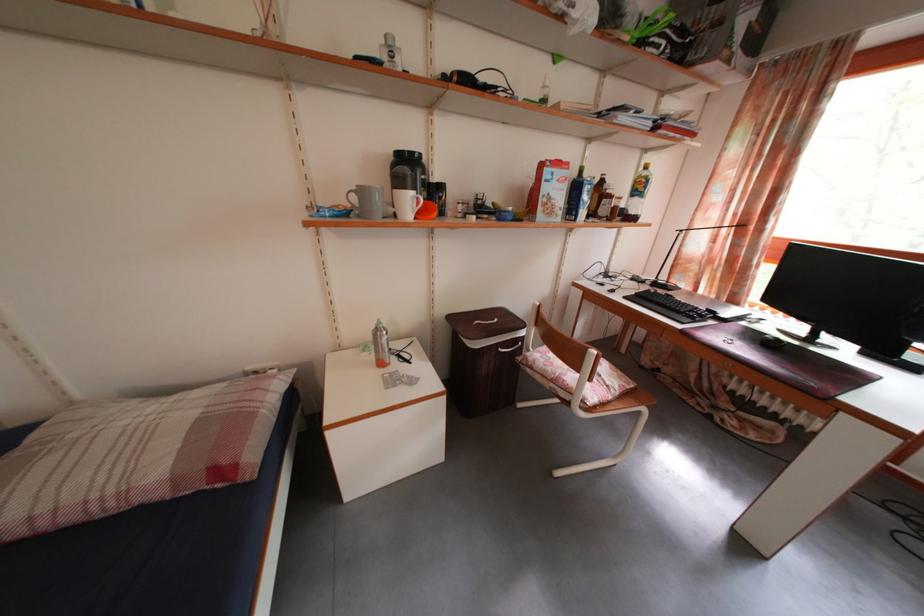
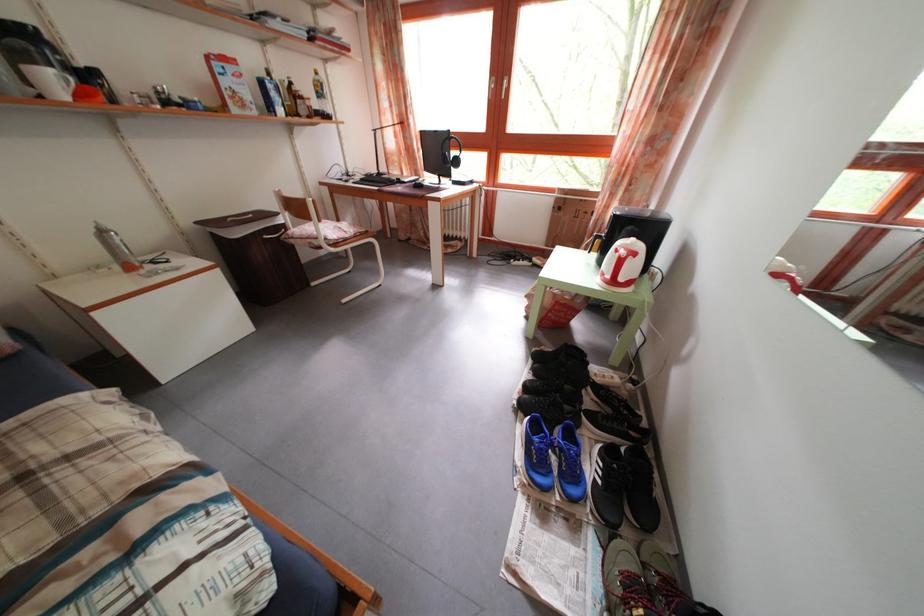
In the second image, find the point that corresponds to point 384,338 in the first image.

(108, 238)